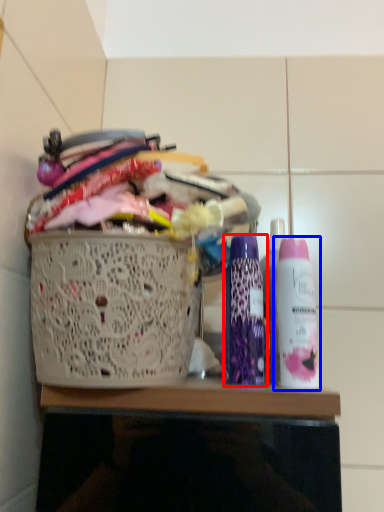
Question: Which point is further to the camera, bottle (highlighted by a red box) or bottle (highlighted by a blue box)?

Choices:
 (A) bottle
 (B) bottle

Answer: (A)